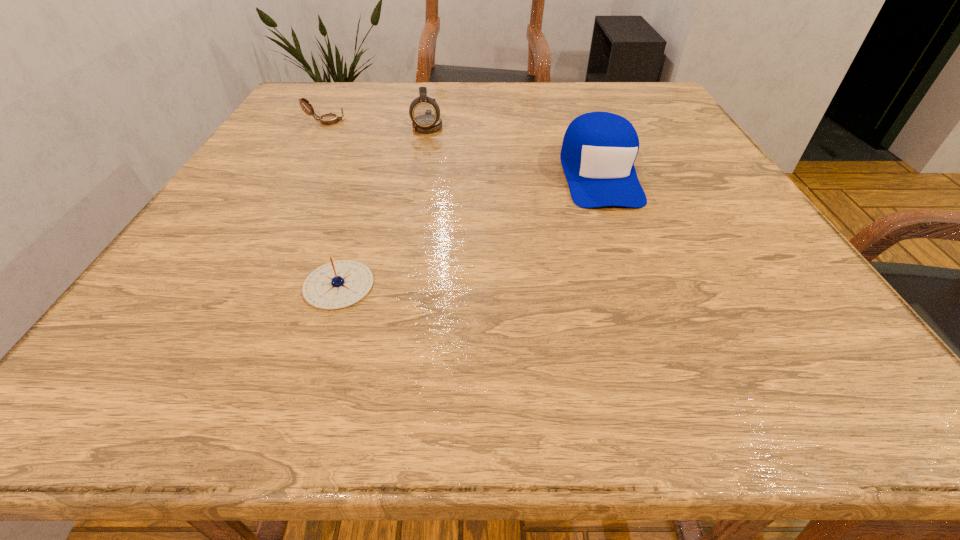
Where is `the second closest object to the leftmost object`? the second closest object to the leftmost object is located at coordinates (338, 284).

Select which object is the second closest to the leftmost object. Please provide its 2D coordinates. Your answer should be formatted as a tuple, i.e. [(x, y)], where the tuple contains the x and y coordinates of a point satisfying the conditions above.

[(338, 284)]

Select which compass is the second closest to the tallest compass. Please provide its 2D coordinates. Your answer should be formatted as a tuple, i.e. [(x, y)], where the tuple contains the x and y coordinates of a point satisfying the conditions above.

[(338, 284)]

Identify which compass is located as the second nearest to the second object from left to right. Please provide its 2D coordinates. Your answer should be formatted as a tuple, i.e. [(x, y)], where the tuple contains the x and y coordinates of a point satisfying the conditions above.

[(327, 119)]